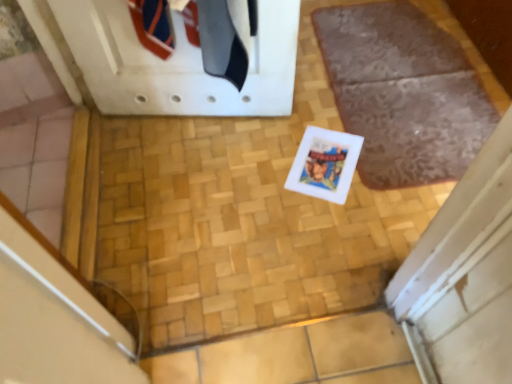
What do you see at coordinates (403, 93) in the screenshot? The width and height of the screenshot is (512, 384). I see `brown textured mat at center` at bounding box center [403, 93].

Locate an element on the screen. The width and height of the screenshot is (512, 384). brown textured mat at center is located at coordinates (403, 93).

In order to face brown textured mat at center, should I rotate leftwards or rightwards?

To face it directly, rotate right by 20.545 degrees.

Identify the location of brown textured mat at center. The width and height of the screenshot is (512, 384). (403, 93).